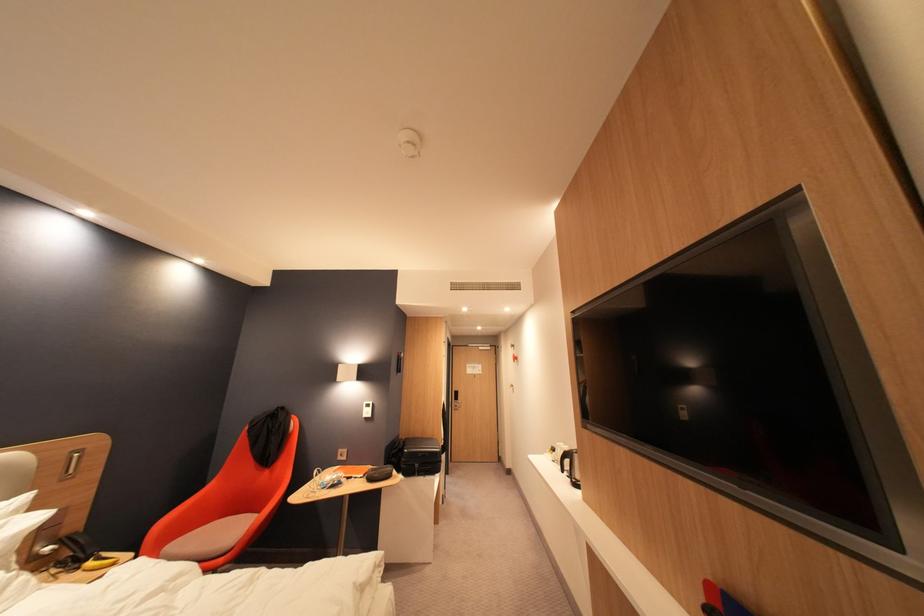
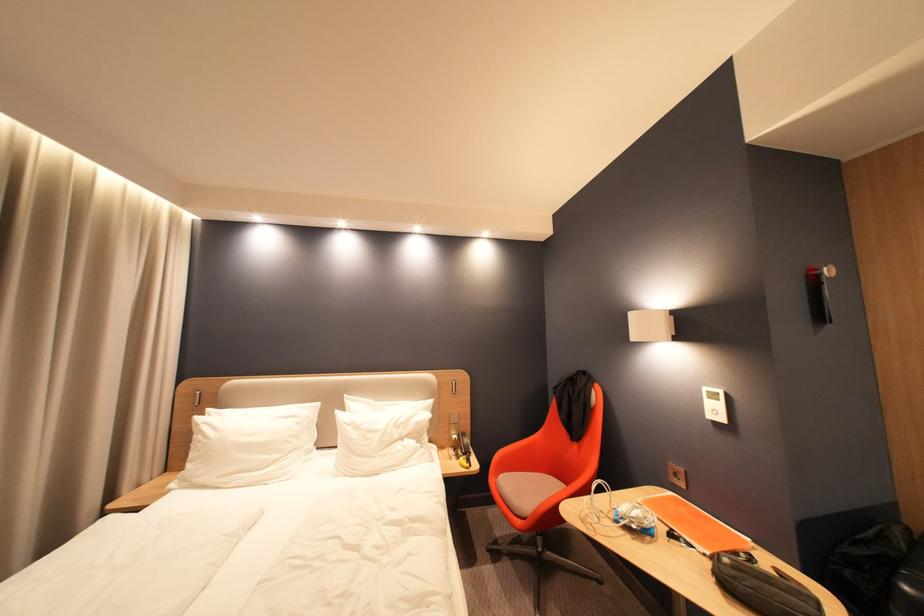
Locate, in the second image, the point that corresponds to [371,477] in the first image.

(714, 556)